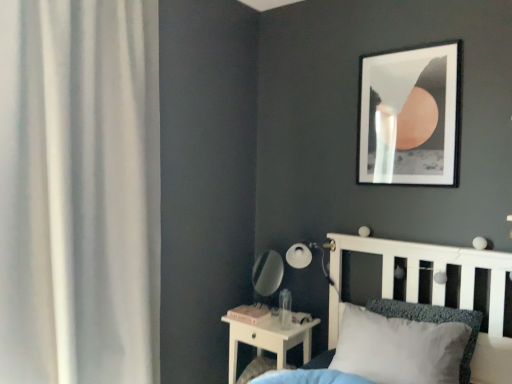
I want to click on free space above white wood nightstand at lower center (from a real-world perspective), so click(x=277, y=318).